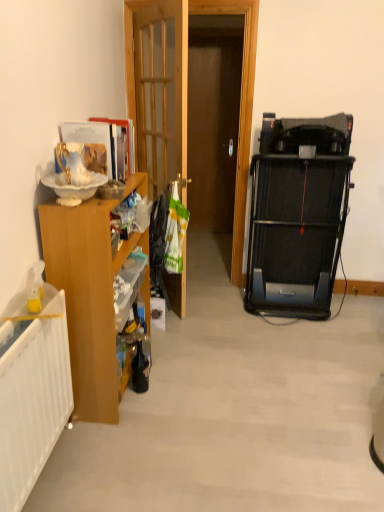
Question: Is point (72, 347) positioned closer to the camera than point (182, 105)?

Choices:
 (A) farther
 (B) closer

Answer: (B)

Question: Relative to wooden at left, is wooden cabinet at left in front or behind?

Choices:
 (A) behind
 (B) front

Answer: (B)

Question: From the image's perspective, relative to wooden at left, is wooden cabinet at left above or below?

Choices:
 (A) below
 (B) above

Answer: (A)

Question: In the image, is wooden at left on the left side or the right side of wooden cabinet at left?

Choices:
 (A) left
 (B) right

Answer: (B)

Question: From the image's perspective, is wooden at left positioned above or below wooden cabinet at left?

Choices:
 (A) below
 (B) above

Answer: (B)

Question: From a real-world perspective, is wooden at left physically located above or below wooden cabinet at left?

Choices:
 (A) below
 (B) above

Answer: (B)

Question: Considering the positions of wooden at left and wooden cabinet at left in the image, is wooden at left wider or thinner than wooden cabinet at left?

Choices:
 (A) wide
 (B) thin

Answer: (B)